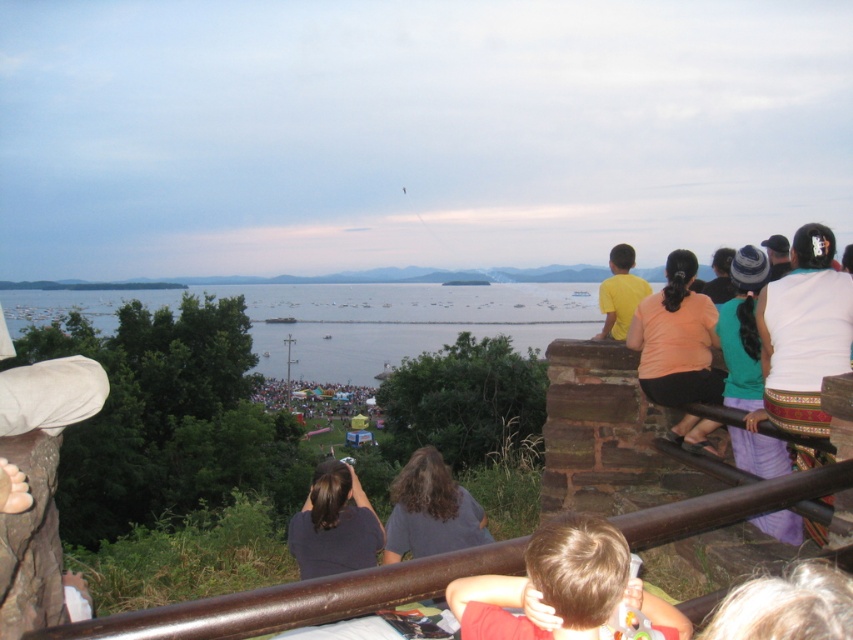
You are a photographer standing in front of the scene. You want to take a closeup photo of the light brown hair at lower center. The camera you are using has a minimum focusing distance of 2 meters. Can you take the photo without moving closer?

The light brown hair at lower center is 1.95 meters from viewer, so the camera cannot focus because the minimum focusing distance is 2 meters. Move back or use a different lens.